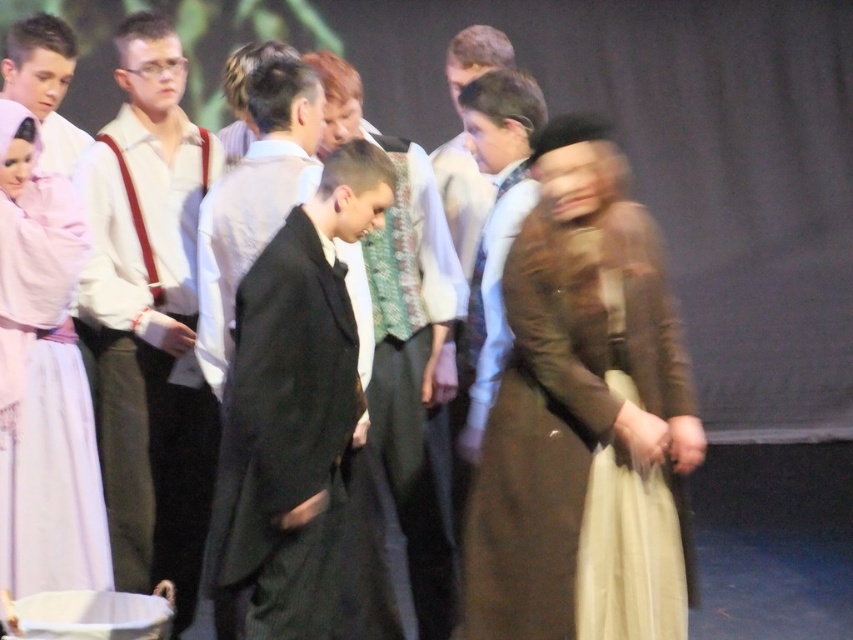
You are an audience member sitting in the front row of the theater. You notice two main characters on stage wearing the brown textured coat at center and the black woolen suit at center. Which character is closer to you?

The brown textured coat at center is closer to you than the black woolen suit at center.

Based on the scene description, which object is positioned to the left of the other between the matte white shirt at left and the black woolen suit at center?

The matte white shirt at left is positioned to the left of the black woolen suit at center according to the description.